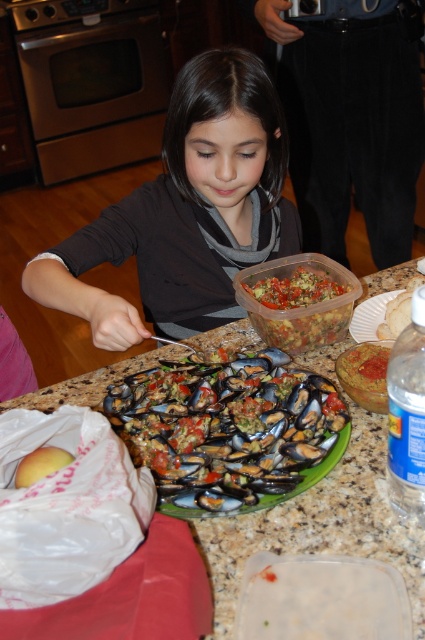
You are standing in the kitchen and want to place a 25 inch tall cake on the granite countertop. The point where you want to place it is at coordinates point (240, 532). Given that the distance from you to that point is 30.05 inches, will the cake fit vertically if you place it there?

The distance from you to the point (240, 532) is 30.05 inches. Since the cake is 25 inches tall, it will fit vertically as the distance is greater than the cake height.

You are standing in the kitchen and want to pick up an object located at point (x=246, y=483). However, there is another object at point (x=71, y=460) in your way. Can you reach the first object without moving the second one?

Point (x=246, y=483) is further to the camera than point (x=71, y=460), so yes, you can reach the first object without moving the second one because it is closer to you.